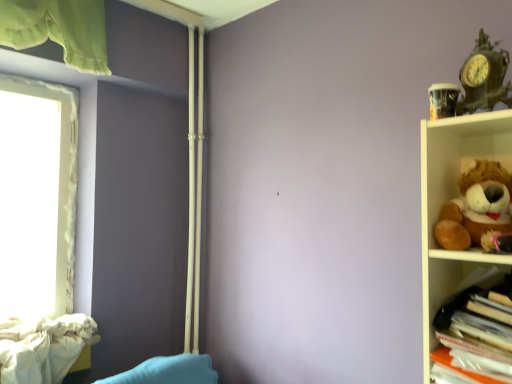
Question: From a real-world perspective, is antique bronze clock at upper right, the first toy from the top, positioned above or below brown plush toy at right, the 1th toy in the bottom-to-top sequence?

Choices:
 (A) below
 (B) above

Answer: (B)

Question: Is antique bronze clock at upper right, the 2th toy ordered from the bottom, spatially inside brown plush toy at right, the second toy when ordered from top to bottom, or outside of it?

Choices:
 (A) inside
 (B) outside

Answer: (B)

Question: Which of these objects is positioned farthest from the brown plush toy at right, the second toy when ordered from top to bottom?

Choices:
 (A) translucent plastic folders at right
 (B) white textured curtain at left
 (C) antique bronze clock at upper right, the first toy from the top

Answer: (B)

Question: Which object is the closest to the white textured curtain at left?

Choices:
 (A) brown plush toy at right, the second toy when ordered from top to bottom
 (B) antique bronze clock at upper right, the first toy from the top
 (C) translucent plastic folders at right

Answer: (C)